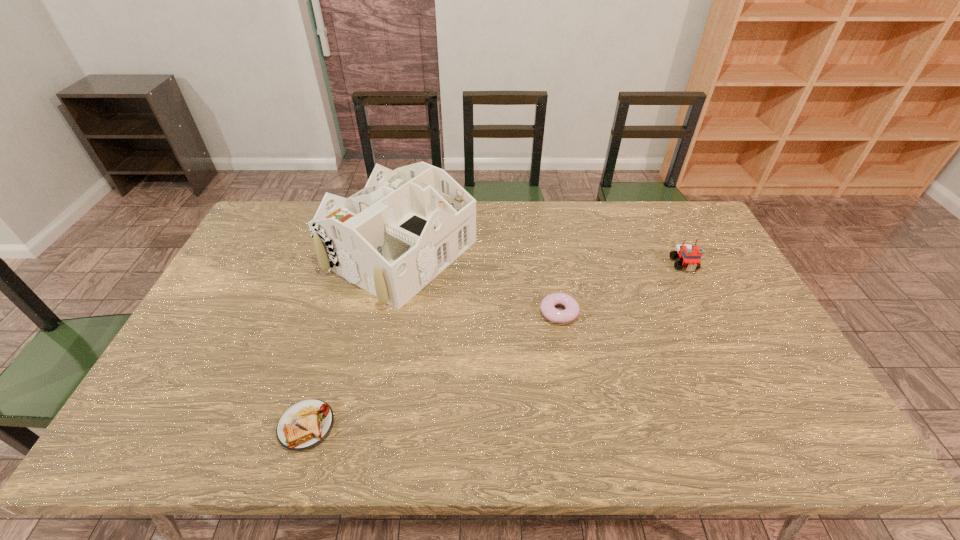
Where is `the tallest object`? the tallest object is located at coordinates (392, 238).

Where is `the rightmost object`? The image size is (960, 540). the rightmost object is located at coordinates (689, 255).

The height and width of the screenshot is (540, 960). I want to click on Lego, so click(x=689, y=255).

Locate an element on the screen. The height and width of the screenshot is (540, 960). the second object from right to left is located at coordinates point(547,307).

Image resolution: width=960 pixels, height=540 pixels. In order to click on doughnut in this screenshot , I will do `click(547, 307)`.

At what (x,y) coordinates should I click in order to perform the action: click on the shortest object. Please return your answer as a coordinate pair (x, y). The image size is (960, 540). Looking at the image, I should click on (304, 425).

Image resolution: width=960 pixels, height=540 pixels. Find the location of `sandwich`. sandwich is located at coordinates (304, 425).

Where is `vacant space located 0.200m on the right of the tallest object`? This screenshot has width=960, height=540. vacant space located 0.200m on the right of the tallest object is located at coordinates (537, 253).

This screenshot has height=540, width=960. Identify the location of blank area located 0.340m on the front-facing side of the Lego. (733, 365).

The image size is (960, 540). I want to click on free space located on the back of the doughnut, so click(x=548, y=251).